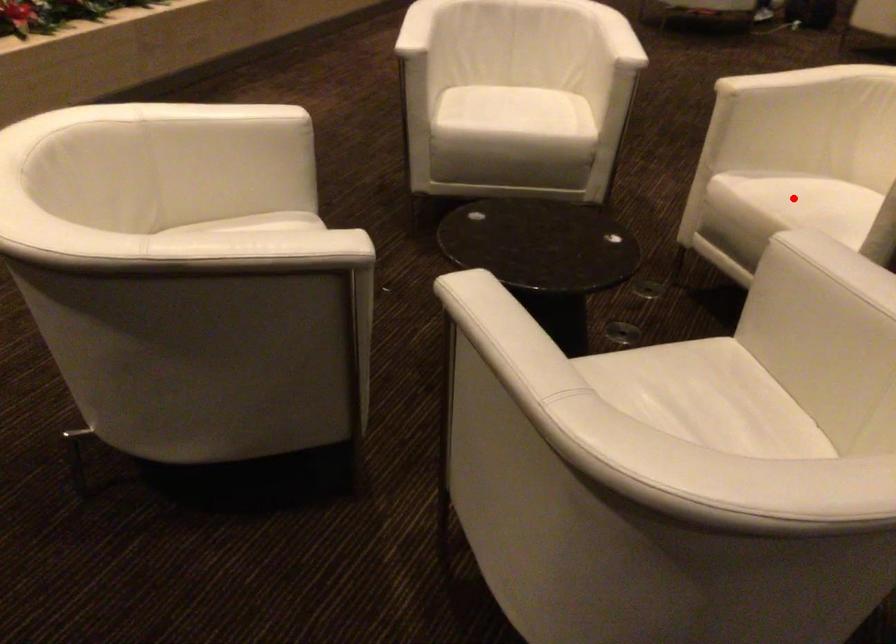
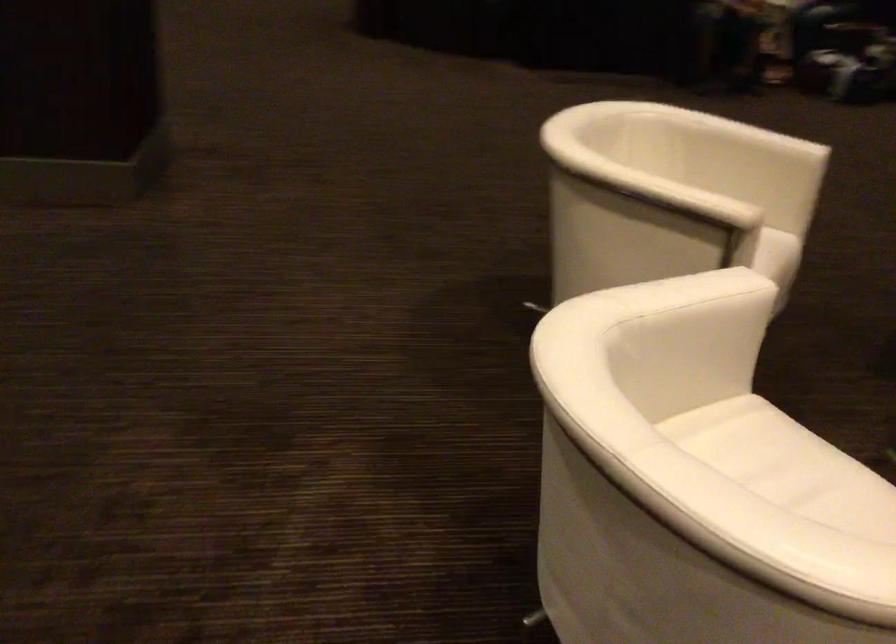
Question: I am providing you with two images of the same scene from different viewpoints. A red point is marked on the first image. Is the red point's position out of view in image 2?

Choices:
 (A) Yes
 (B) No

Answer: (A)